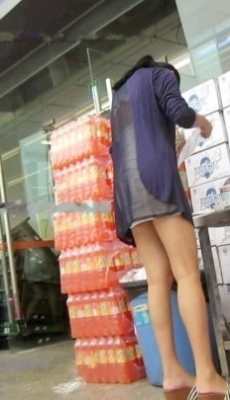
At what (x,y) coordinates should I click in order to perform the action: click on box. Please return your answer as a coordinate pair (x, y). Looking at the image, I should click on (203, 100), (226, 92), (214, 134), (227, 109), (211, 167), (209, 199), (225, 239), (227, 257), (216, 267), (224, 295).